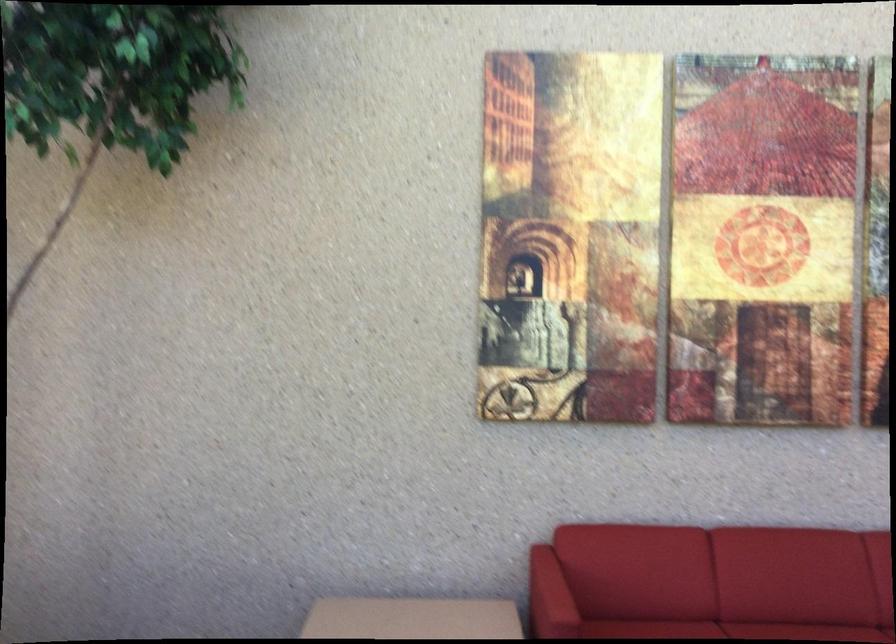
This screenshot has width=896, height=644. Describe the element at coordinates (549, 597) in the screenshot. I see `the sofa armrest` at that location.